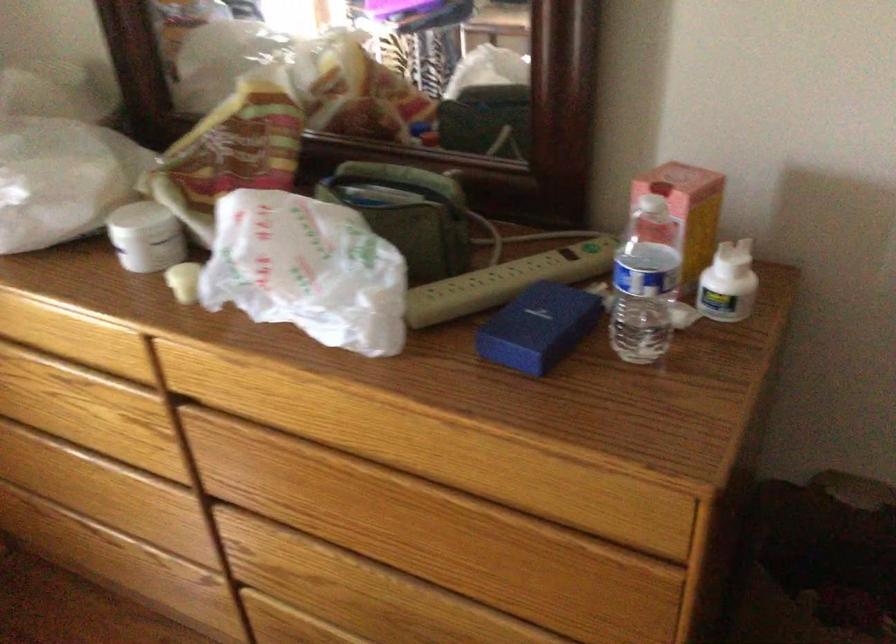
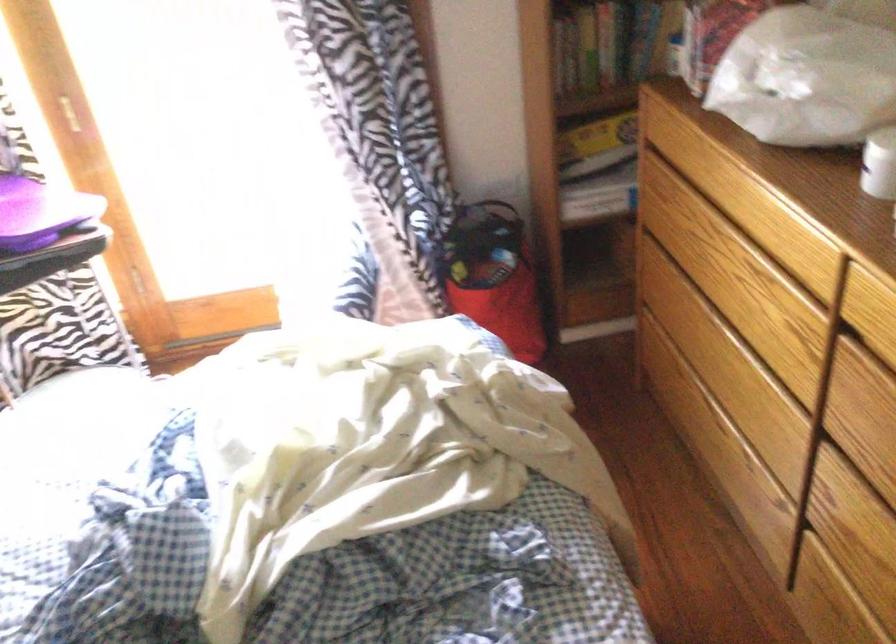
Where in the second image is the point corresponding to point 257,502 from the first image?

(868, 460)